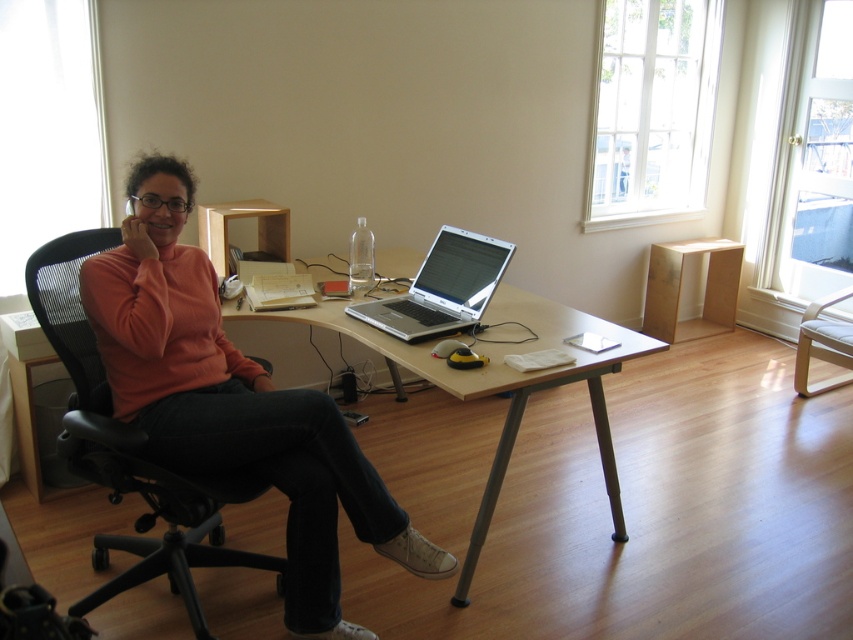
Question: Which point is farther to the camera?

Choices:
 (A) black leather swivel chair at center
 (B) matte orange sweater at center
 (C) silver metallic laptop at center
 (D) silver metallic table at center

Answer: (A)

Question: Does matte orange sweater at center appear over black leather swivel chair at center?

Choices:
 (A) no
 (B) yes

Answer: (A)

Question: Among these objects, which one is nearest to the camera?

Choices:
 (A) silver metallic laptop at center
 (B) matte orange sweater at center

Answer: (B)

Question: Can you confirm if black mesh office chair at left is wider than silver metallic table at center?

Choices:
 (A) yes
 (B) no

Answer: (B)

Question: Among these objects, which one is nearest to the camera?

Choices:
 (A) silver metallic table at center
 (B) black leather swivel chair at center

Answer: (A)

Question: Is black mesh office chair at left thinner than silver metallic laptop at center?

Choices:
 (A) yes
 (B) no

Answer: (B)